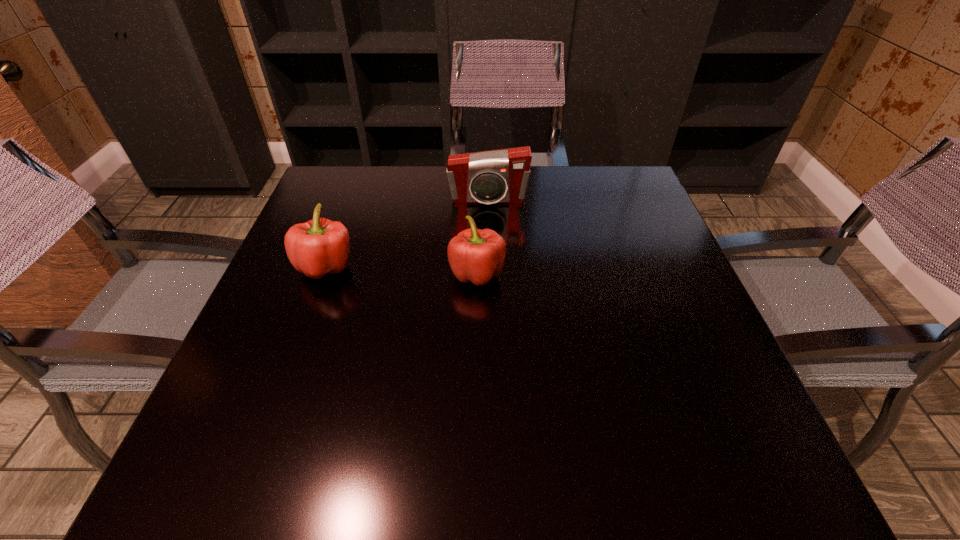
In order to click on the farthest object in this screenshot , I will do `click(498, 176)`.

The image size is (960, 540). I want to click on the left bell pepper, so click(x=320, y=246).

This screenshot has width=960, height=540. I want to click on the right bell pepper, so click(474, 255).

The width and height of the screenshot is (960, 540). I want to click on vacant space located on the front-facing side of the farthest object, so click(x=491, y=313).

The image size is (960, 540). Find the location of `vacant region located 0.270m on the front of the left bell pepper`. vacant region located 0.270m on the front of the left bell pepper is located at coordinates (276, 402).

Identify the location of vacant space located 0.400m on the back of the right bell pepper. The width and height of the screenshot is (960, 540). (478, 166).

Locate an element on the screen. object situated at the far edge is located at coordinates (498, 176).

Image resolution: width=960 pixels, height=540 pixels. What are the coordinates of `object positioned at the left edge` in the screenshot? It's located at (320, 246).

Locate an element on the screen. vacant space at the far edge of the desktop is located at coordinates (396, 195).

Find the location of `vacant point at the near edge`. vacant point at the near edge is located at coordinates (426, 443).